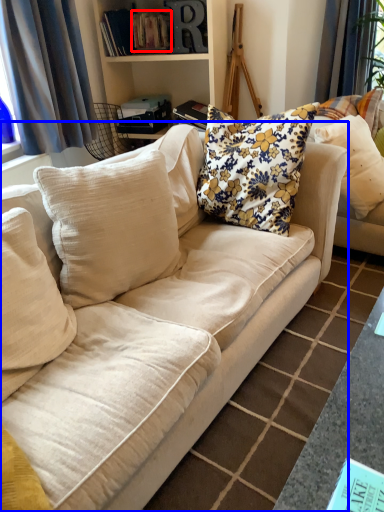
Question: Which point is further to the camera, book (highlighted by a red box) or studio couch (highlighted by a blue box)?

Choices:
 (A) book
 (B) studio couch

Answer: (A)